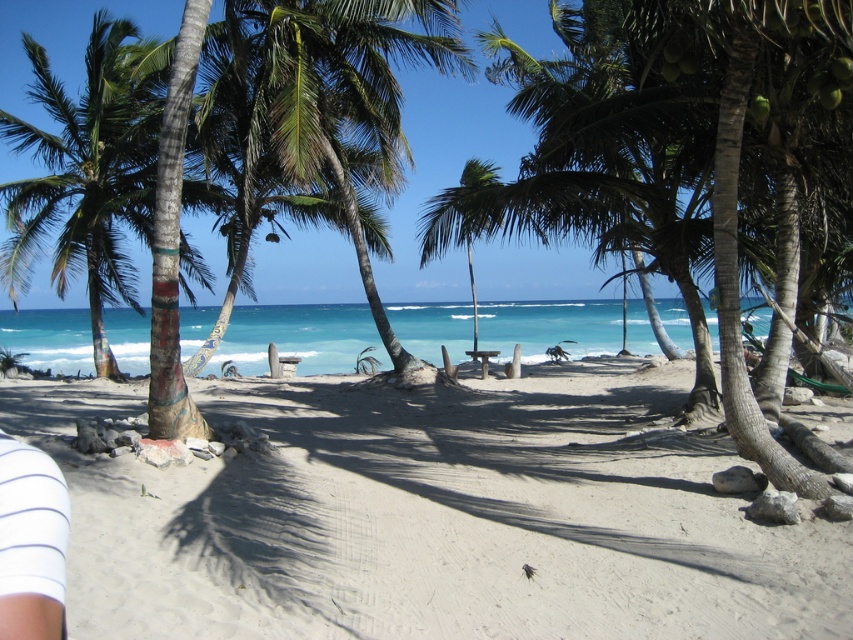
You are a photographer trying to capture a photo of the white sandy beach at center and the white striped leg at lower left. Which object appears larger in the photo?

The white sandy beach at center appears larger in the photo because it is much taller than the white striped leg at lower left.

You are a photographer standing at the lower left of the beach scene. You want to take a photo that includes both the white striped leg at lower left and the green leafy palm tree at center. Given that your camera has a maximum zoom range of 10 feet, can you capture both objects in a single frame without moving your position?

The white striped leg at lower left and green leafy palm tree at center are 31.49 feet apart. Since your camera can only zoom up to 10 feet, you cannot capture both objects in a single frame without moving your position because the distance between them exceeds the camera range.